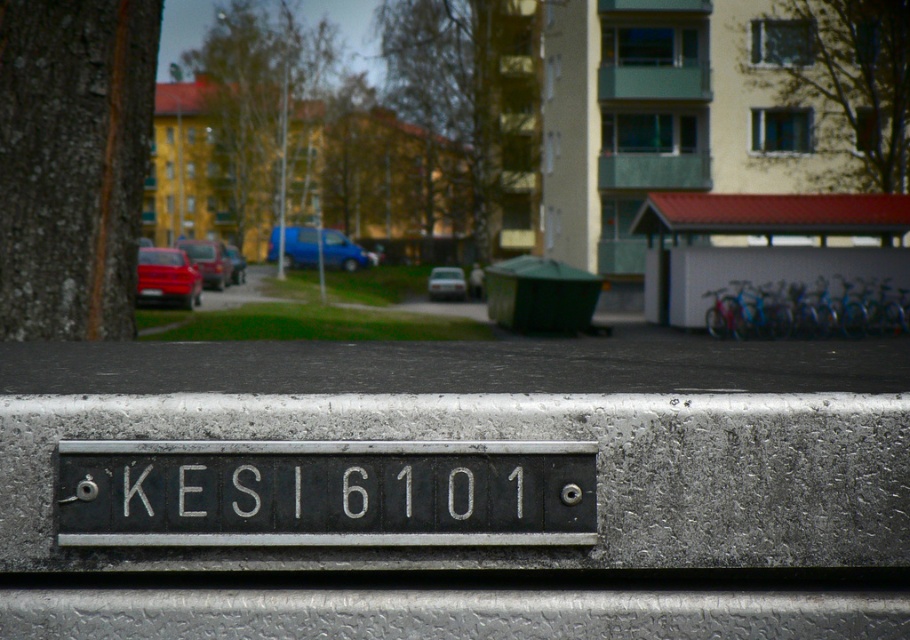
Question: Among these objects, which one is nearest to the camera?

Choices:
 (A) metallic silver car at center
 (B) matte red car at center

Answer: (A)

Question: Can you confirm if black metal sign at center is thinner than matte blue van at center?

Choices:
 (A) yes
 (B) no

Answer: (A)

Question: Which point is farther from the camera taking this photo?

Choices:
 (A) (349, 460)
 (B) (352, 244)
 (C) (197, 243)

Answer: (B)

Question: Which object appears closest to the camera in this image?

Choices:
 (A) matte blue van at center
 (B) matte red car at center

Answer: (B)

Question: Is blue matte van at center bigger than matte red car at center?

Choices:
 (A) yes
 (B) no

Answer: (B)

Question: Can you confirm if matte red car at center is bigger than metallic silver car at center?

Choices:
 (A) yes
 (B) no

Answer: (A)